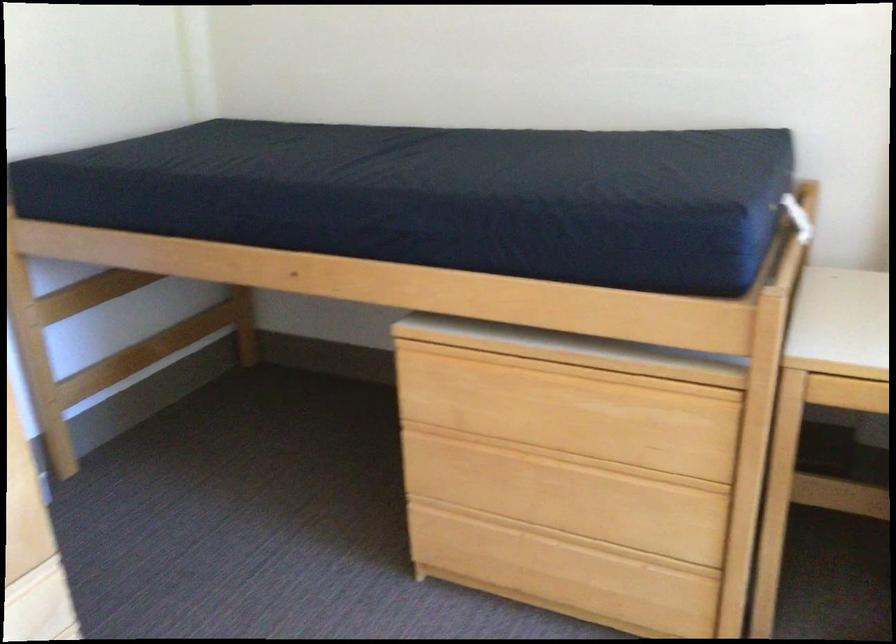
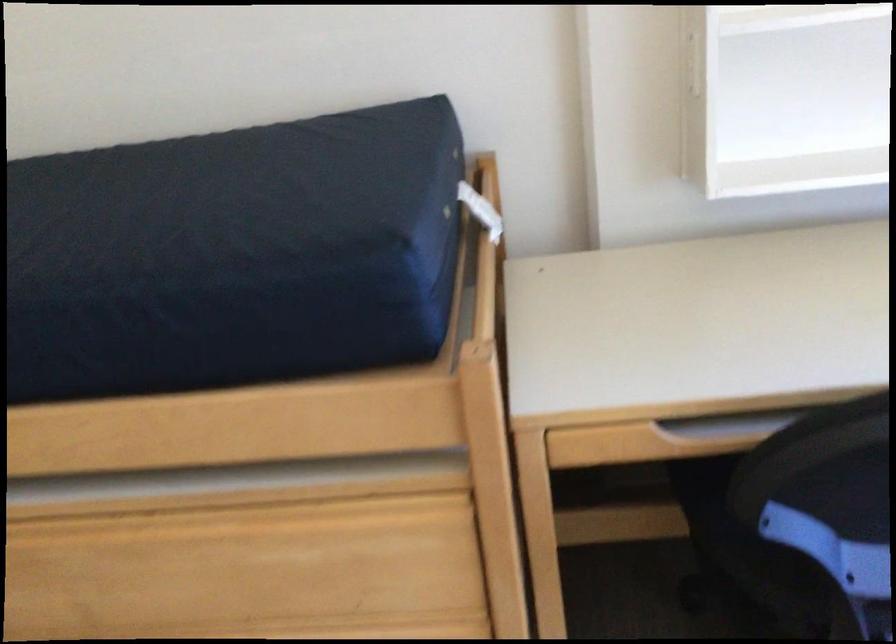
Question: The camera is either moving clockwise (left) or counter-clockwise (right) around the object. The first image is from the beginning of the video and the second image is from the end. Is the camera moving left or right when shooting the video?

Choices:
 (A) Left
 (B) Right

Answer: (A)